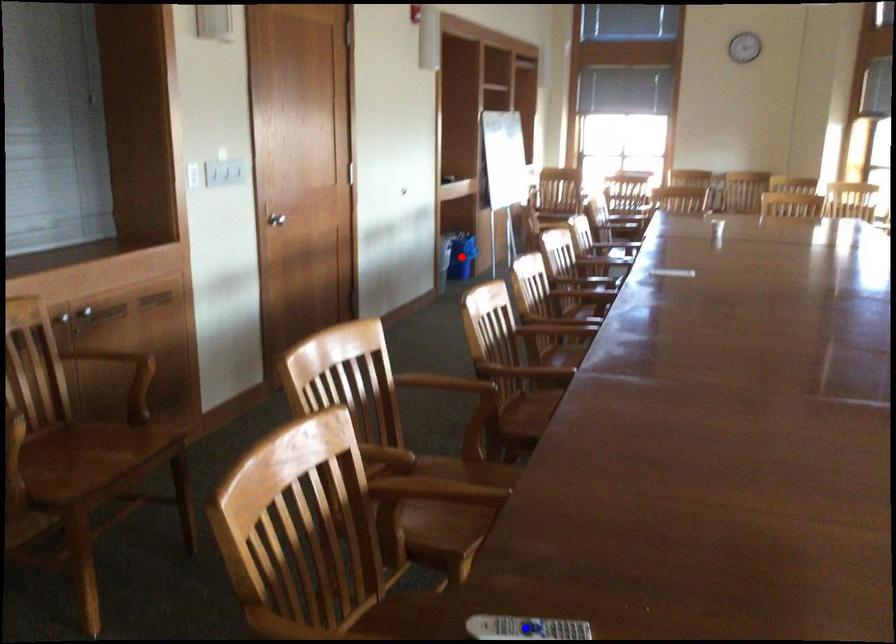
Question: Which of the two points in the image is closer to the camera?

Choices:
 (A) Blue point is closer.
 (B) Red point is closer.

Answer: (A)